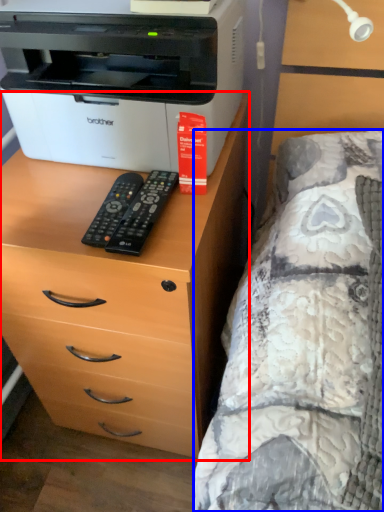
Question: Which object is closer to the camera taking this photo, chest of drawers (highlighted by a red box) or bed (highlighted by a blue box)?

Choices:
 (A) chest of drawers
 (B) bed

Answer: (B)